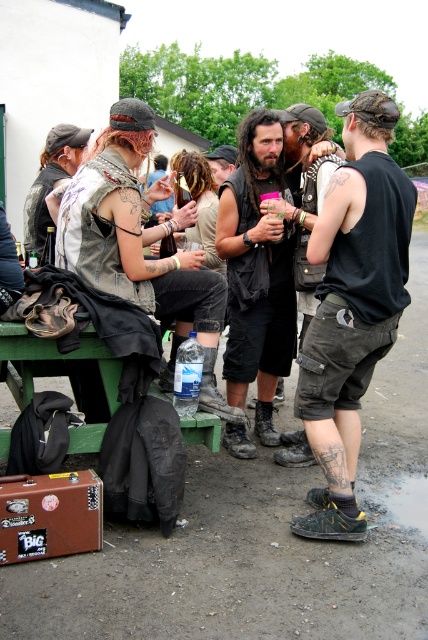
Question: In this image, where is dark brown leather vest at center located relative to matte black vest at center?

Choices:
 (A) above
 (B) below

Answer: (B)

Question: Which of these objects is positioned farthest from the black matte cargo shorts at center?

Choices:
 (A) matte black vest at center
 (B) dark brown leather vest at center

Answer: (B)

Question: Among these objects, which one is nearest to the camera?

Choices:
 (A) black matte cargo shorts at center
 (B) dark brown leather vest at center
 (C) matte black vest at center

Answer: (A)

Question: Can you confirm if black matte cargo shorts at center is positioned to the left of matte black vest at center?

Choices:
 (A) no
 (B) yes

Answer: (A)

Question: Which point is farther to the camera?

Choices:
 (A) dark brown leather vest at center
 (B) matte black vest at center

Answer: (A)

Question: Is the position of black matte cargo shorts at center more distant than that of dark brown leather vest at center?

Choices:
 (A) no
 (B) yes

Answer: (A)